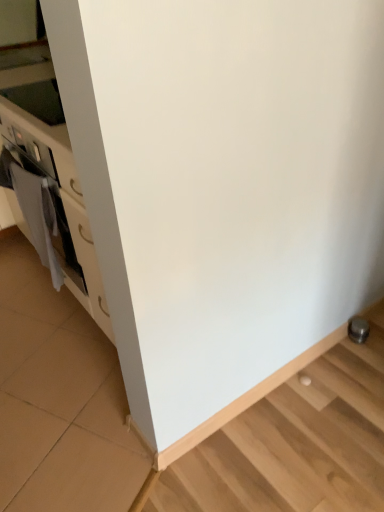
Question: From a real-world perspective, relative to metallic silver stairwell at lower right, is white fabric at left vertically above or below?

Choices:
 (A) below
 (B) above

Answer: (B)

Question: Is white fabric at left inside or outside of metallic silver stairwell at lower right?

Choices:
 (A) inside
 (B) outside

Answer: (B)

Question: Considering the relative positions of white fabric at left and metallic silver stairwell at lower right in the image provided, is white fabric at left to the left or to the right of metallic silver stairwell at lower right?

Choices:
 (A) left
 (B) right

Answer: (A)

Question: From the image's perspective, is metallic silver stairwell at lower right located above or below white fabric at left?

Choices:
 (A) above
 (B) below

Answer: (B)

Question: Relative to white fabric at left, is metallic silver stairwell at lower right in front or behind?

Choices:
 (A) front
 (B) behind

Answer: (A)

Question: From a real-world perspective, is metallic silver stairwell at lower right positioned above or below white fabric at left?

Choices:
 (A) below
 (B) above

Answer: (A)

Question: Does point (370, 334) appear closer or farther from the camera than point (44, 230)?

Choices:
 (A) farther
 (B) closer

Answer: (A)